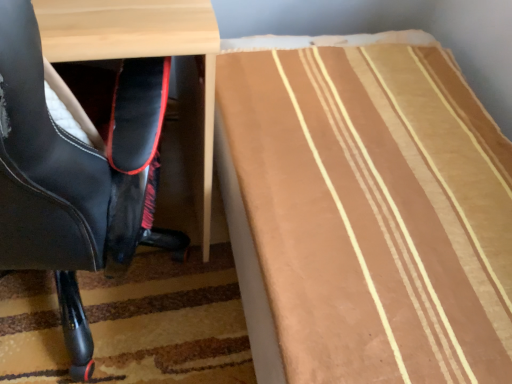
Question: Is brown striped fabric at lower right taller or shorter than black leather chair at left?

Choices:
 (A) short
 (B) tall

Answer: (A)

Question: Considering the positions of point (342, 107) and point (78, 167), is point (342, 107) closer or farther from the camera than point (78, 167)?

Choices:
 (A) closer
 (B) farther

Answer: (B)

Question: From a real-world perspective, is brown striped fabric at lower right positioned above or below black leather chair at left?

Choices:
 (A) above
 (B) below

Answer: (B)

Question: Is black leather chair at left wider or thinner than brown striped fabric at lower right?

Choices:
 (A) thin
 (B) wide

Answer: (A)

Question: Considering the positions of black leather chair at left and brown striped fabric at lower right in the image, is black leather chair at left bigger or smaller than brown striped fabric at lower right?

Choices:
 (A) big
 (B) small

Answer: (B)

Question: Is point (28, 18) closer or farther from the camera than point (410, 140)?

Choices:
 (A) closer
 (B) farther

Answer: (A)

Question: From a real-world perspective, is black leather chair at left physically located above or below brown striped fabric at lower right?

Choices:
 (A) below
 (B) above

Answer: (B)